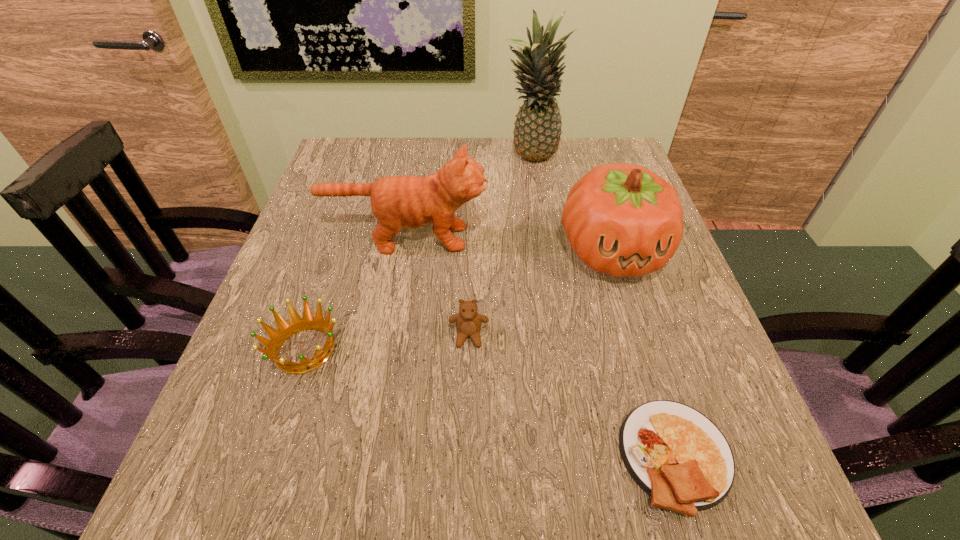
Locate an element on the screen. Image resolution: width=960 pixels, height=540 pixels. blank area located 0.400m on the side of the pumpkin with the cute face is located at coordinates (691, 510).

Where is `vacant space situated on the front-facing side of the teddy bear`? Image resolution: width=960 pixels, height=540 pixels. vacant space situated on the front-facing side of the teddy bear is located at coordinates (466, 485).

Where is `vacant region located 0.230m on the right of the fifth tallest object`? This screenshot has height=540, width=960. vacant region located 0.230m on the right of the fifth tallest object is located at coordinates (473, 349).

Locate an element on the screen. The height and width of the screenshot is (540, 960). blank space located 0.370m on the left of the shortest object is located at coordinates (370, 456).

Image resolution: width=960 pixels, height=540 pixels. What are the coordinates of `object that is at the far edge` in the screenshot? It's located at (537, 131).

Locate an element on the screen. object that is at the near edge is located at coordinates (679, 457).

I want to click on cat that is at the left edge, so click(x=410, y=202).

At what (x,y) coordinates should I click in order to perform the action: click on crown present at the left edge. Please return your answer as a coordinate pair (x, y). Looking at the image, I should click on (296, 324).

The height and width of the screenshot is (540, 960). Find the location of `pumpkin positioned at the right edge`. pumpkin positioned at the right edge is located at coordinates point(621,219).

You are a GUI agent. You are given a task and a screenshot of the screen. Output one action in this format:
    pyautogui.click(x=<x>, y=<y>)
    Task: Click on the omelet positioned at the right edge
    The height and width of the screenshot is (540, 960).
    Given the screenshot: What is the action you would take?
    pyautogui.click(x=679, y=457)